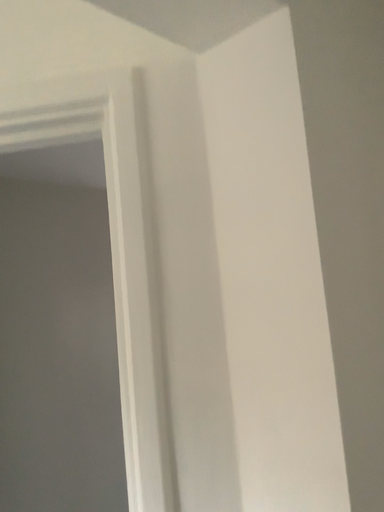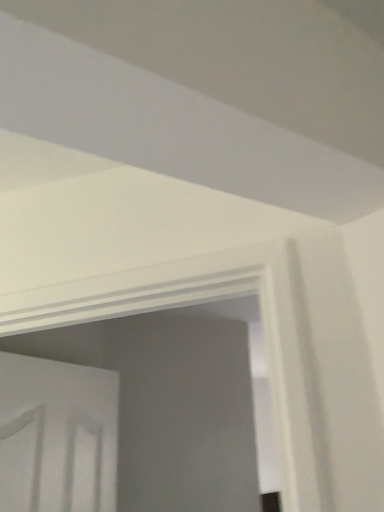
Question: How did the camera likely rotate when shooting the video?

Choices:
 (A) rotated downward
 (B) rotated upward

Answer: (B)